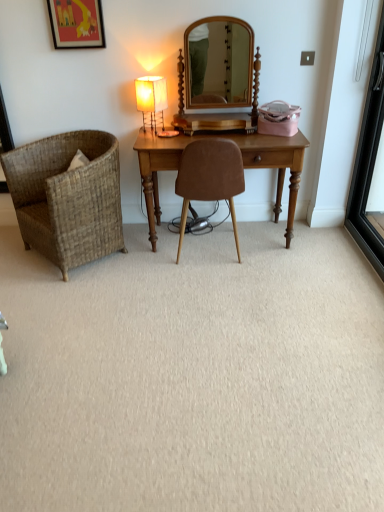
You are a GUI agent. You are given a task and a screenshot of the screen. Output one action in this format:
    pyautogui.click(x=<x>, y=<y>)
    Task: Click on the spots to the right of brown suede chair at center, which is counted as the 2th chair, starting from the left
    This screenshot has width=384, height=512.
    Given the screenshot: What is the action you would take?
    pyautogui.click(x=286, y=260)